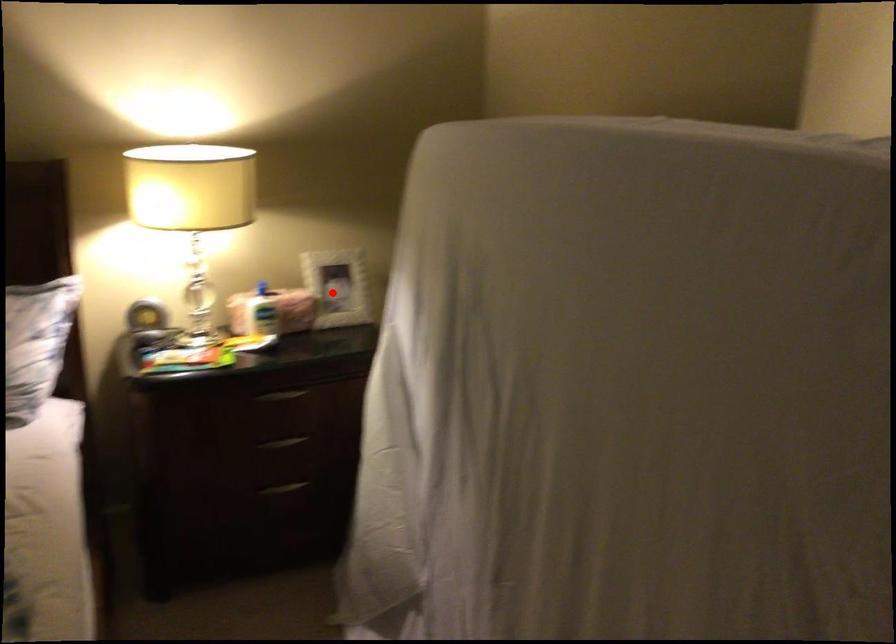
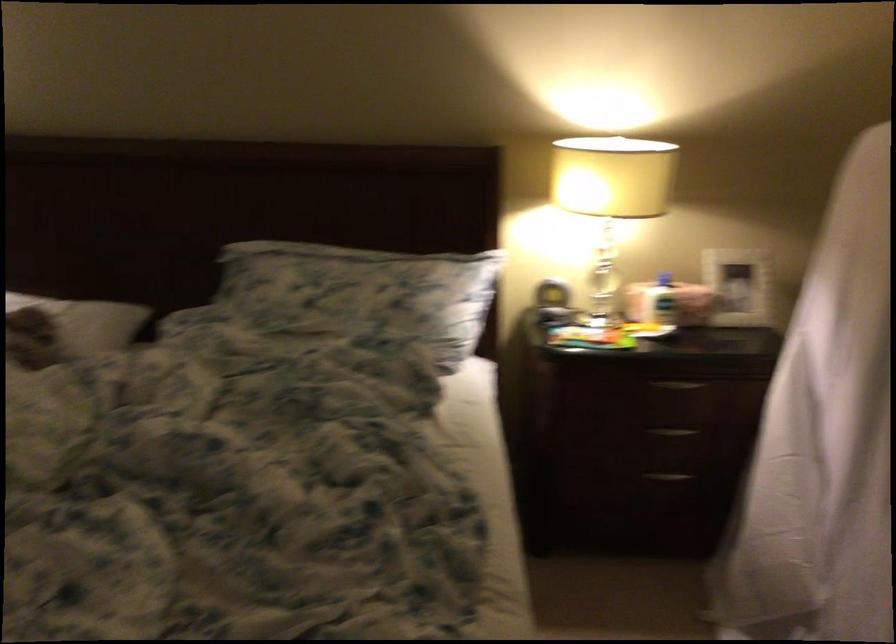
In the second image, find the point that corresponds to the highlighted location in the first image.

(737, 286)